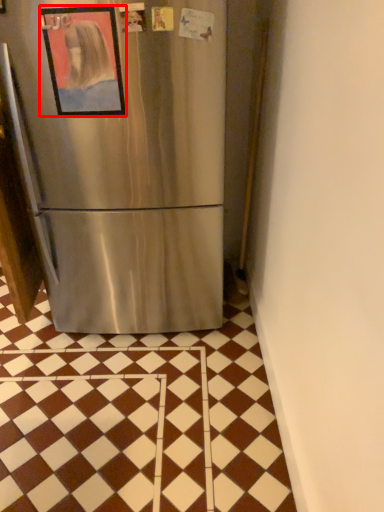
Question: From the image's perspective, where is picture frame (annotated by the red box) located in relation to tile in the image?

Choices:
 (A) above
 (B) below

Answer: (A)